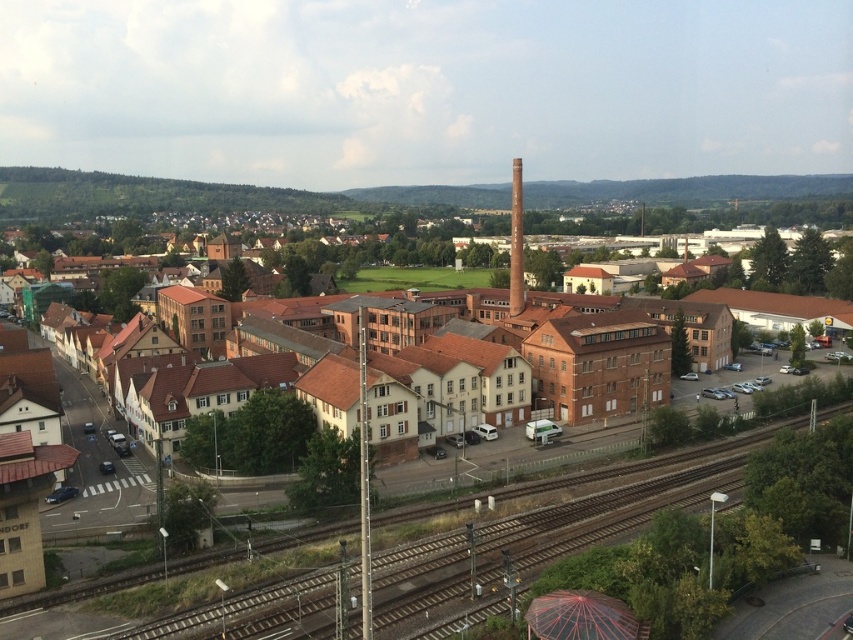
Question: Which point is farther to the camera?

Choices:
 (A) (44, 248)
 (B) (100, 586)

Answer: (A)

Question: Which object appears closest to the camera in this image?

Choices:
 (A) brown brick building at center
 (B) brown wooden train track at lower center

Answer: (B)

Question: Can you confirm if brown brick building at center is thinner than brown wooden train track at lower center?

Choices:
 (A) no
 (B) yes

Answer: (A)

Question: Among these points, which one is nearest to the camera?

Choices:
 (A) (119, 310)
 (B) (289, 545)

Answer: (B)

Question: Can you confirm if brown brick building at center is positioned below brown wooden train track at lower center?

Choices:
 (A) no
 (B) yes

Answer: (A)

Question: Is brown brick building at center above brown wooden train track at lower center?

Choices:
 (A) no
 (B) yes

Answer: (B)